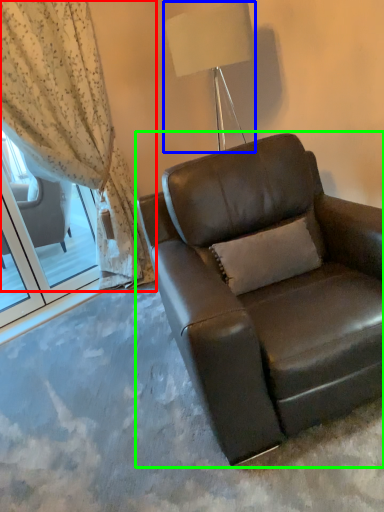
Question: Considering the real-world distances, which object is farthest from curtain (highlighted by a red box)? lamp (highlighted by a blue box) or chair (highlighted by a green box)?

Choices:
 (A) lamp
 (B) chair

Answer: (B)